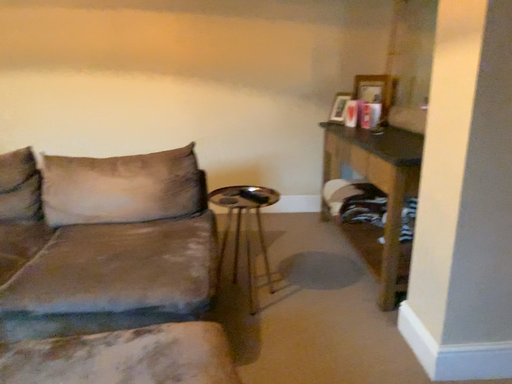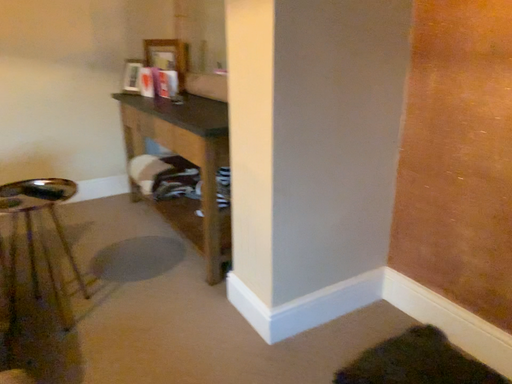
Question: Which way did the camera rotate in the video?

Choices:
 (A) rotated left
 (B) rotated right

Answer: (B)